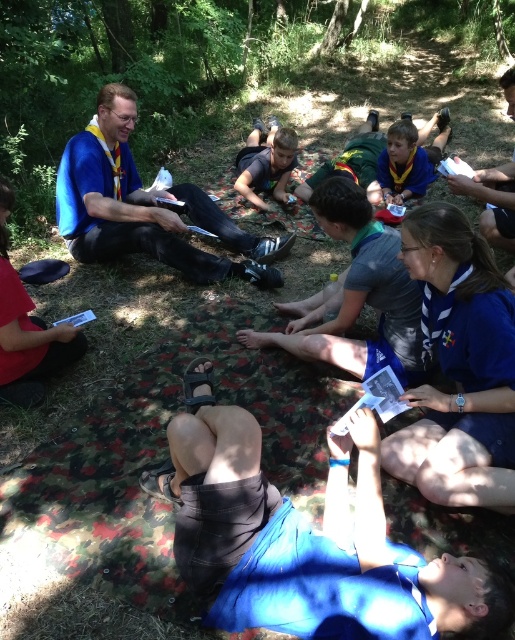
You are a scout leader trying to organize a group activity. You have a blue fabric at lower center and a matte black phone at center. Which object is positioned lower in the scene?

The blue fabric at lower center is located below the matte black phone at center, so the blue fabric at lower center is positioned lower in the scene.

Looking at this image, you are a member of the scout group and need to place a compass on the blue fabric at lower center. What are the coordinates where you should place it?

The coordinates for placing the compass on the blue fabric at lower center are at point (305, 540).